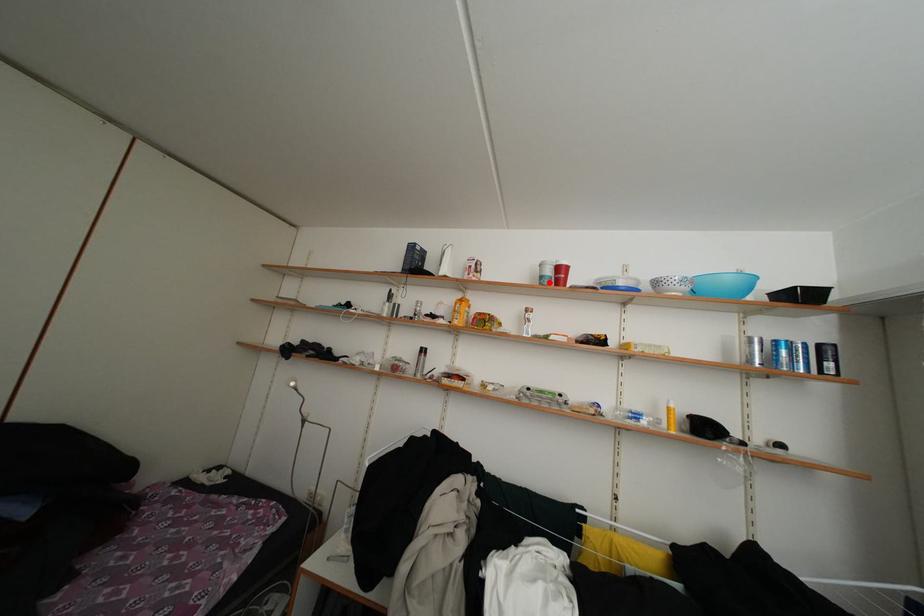
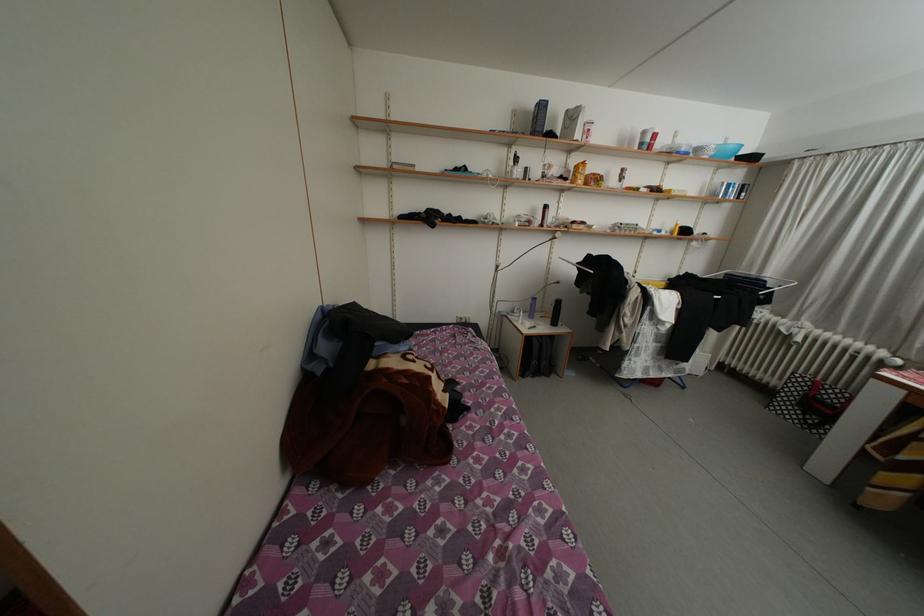
Find the pixel in the second image that matches the highlighted location in the first image.

(650, 148)